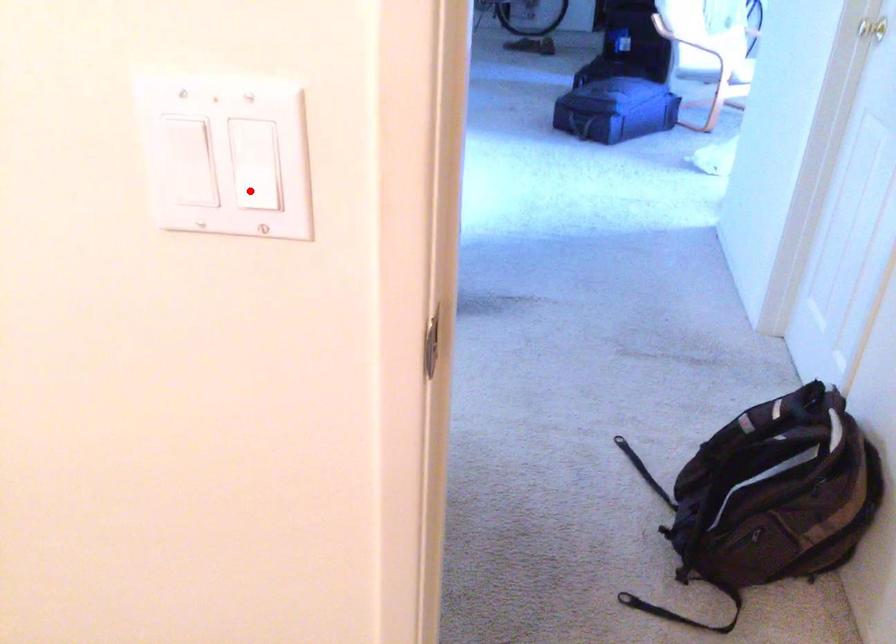
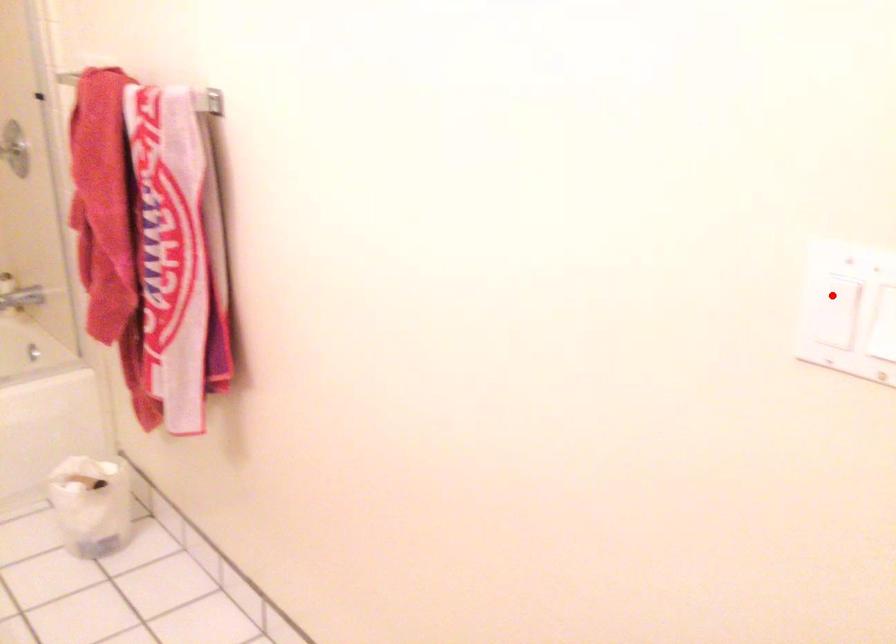
I am providing you with two images of the same scene from different viewpoints. A red point is marked on the first image and another point is marked on the second image. Do the highlighted points in image1 and image2 indicate the same real-world spot?

No